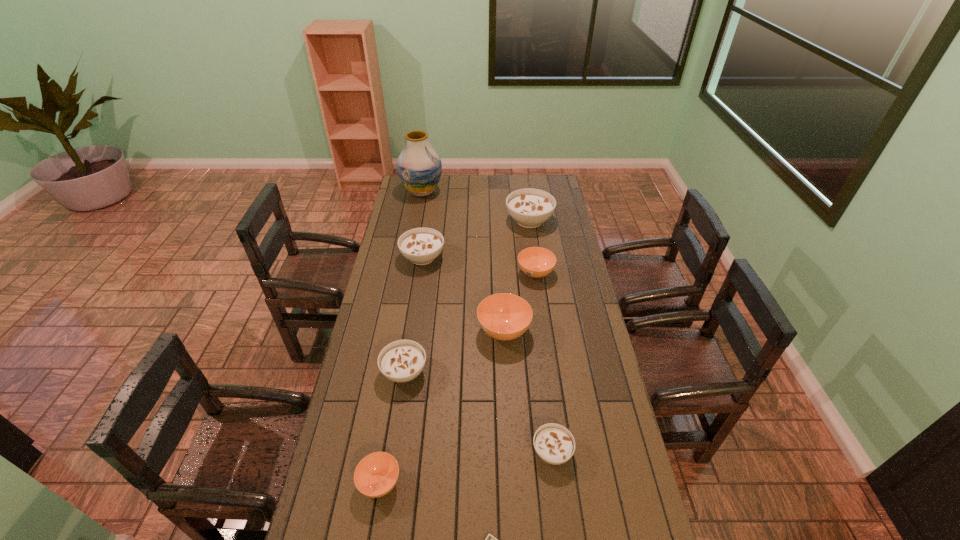
In order to click on vacant space situated on the back of the smallest white soup bowl in this screenshot , I will do coord(540,360).

You are a GUI agent. You are given a task and a screenshot of the screen. Output one action in this format:
    pyautogui.click(x=<x>, y=<y>)
    Task: Click on the object present at the far edge
    
    Given the screenshot: What is the action you would take?
    pyautogui.click(x=419, y=167)

Image resolution: width=960 pixels, height=540 pixels. In order to click on vase situated at the left edge in this screenshot , I will do `click(419, 167)`.

You are a GUI agent. You are given a task and a screenshot of the screen. Output one action in this format:
    pyautogui.click(x=<x>, y=<y>)
    Task: Click on the object present at the far left corner
    
    Given the screenshot: What is the action you would take?
    pyautogui.click(x=419, y=167)

In order to click on free space at the far edge of the desktop in this screenshot , I will do `click(494, 182)`.

Where is `free region at the left edge of the desktop`? free region at the left edge of the desktop is located at coordinates (386, 381).

Where is `free space at the right edge`? free space at the right edge is located at coordinates (574, 269).

Identify the location of free space between the second farthest peach soup bowl and the second smallest white soup bowl. This screenshot has width=960, height=540. (454, 351).

Locate an element on the screen. Image resolution: width=960 pixels, height=540 pixels. empty location between the smallest white soup bowl and the second smallest white soup bowl is located at coordinates (478, 411).

Where is `free space between the smallest white soup bowl and the second biggest white soup bowl`? This screenshot has width=960, height=540. free space between the smallest white soup bowl and the second biggest white soup bowl is located at coordinates (488, 355).